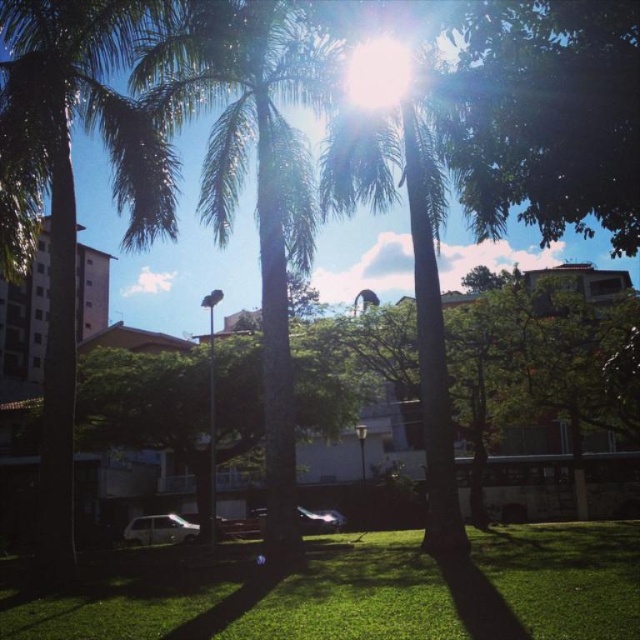
You are standing at the center of the image and want to walk towards the green grass at lower center. Based on the coordinates provided in the Objects Description, in which direction should you move?

The green grass at lower center is located at point (349, 589). Since the coordinates are given as x and y values between 0 and 1, with (0, 0) being the top left corner, moving towards the lower center would require moving to the right and down from the center position.

You are standing in the park and see the green leafy palm tree at left and the green leafy palm tree at center. Which palm tree is closer to you?

The green leafy palm tree at left is closer to you because it is in front of the green leafy palm tree at center.

You are a gardener trying to plant a new flower bed. You see the green grass at lower center and the green leafy palm tree at left. Which object is located below the other?

The green grass at lower center is positioned under the green leafy palm tree at left, so the grass is below the palm tree.